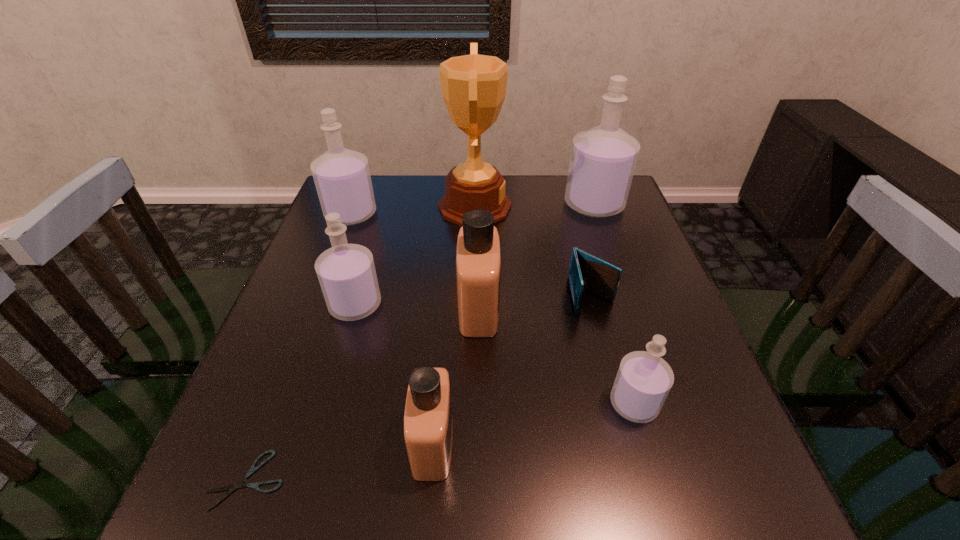
I want to click on vacant area situated 0.340m on the back of the shortest object, so click(x=315, y=305).

Identify the location of award present at the far edge. The width and height of the screenshot is (960, 540). (473, 86).

The width and height of the screenshot is (960, 540). I want to click on perfume that is positioned at the near edge, so click(428, 425).

Where is `shears present at the near edge`? Image resolution: width=960 pixels, height=540 pixels. shears present at the near edge is located at coordinates (231, 488).

Identify the location of shears present at the left edge. Image resolution: width=960 pixels, height=540 pixels. (231, 488).

What are the coordinates of `wallet located at the right edge` in the screenshot? It's located at (586, 272).

At what (x,y) coordinates should I click in order to perform the action: click on object that is at the far left corner. Please return your answer as a coordinate pair (x, y). Looking at the image, I should click on (342, 177).

This screenshot has width=960, height=540. In order to click on object at the near left corner in this screenshot , I will do `click(231, 488)`.

This screenshot has width=960, height=540. Identify the location of object present at the far right corner. (603, 159).

Identify the location of vacant region at the far edge of the desktop. This screenshot has width=960, height=540. pos(396,190).